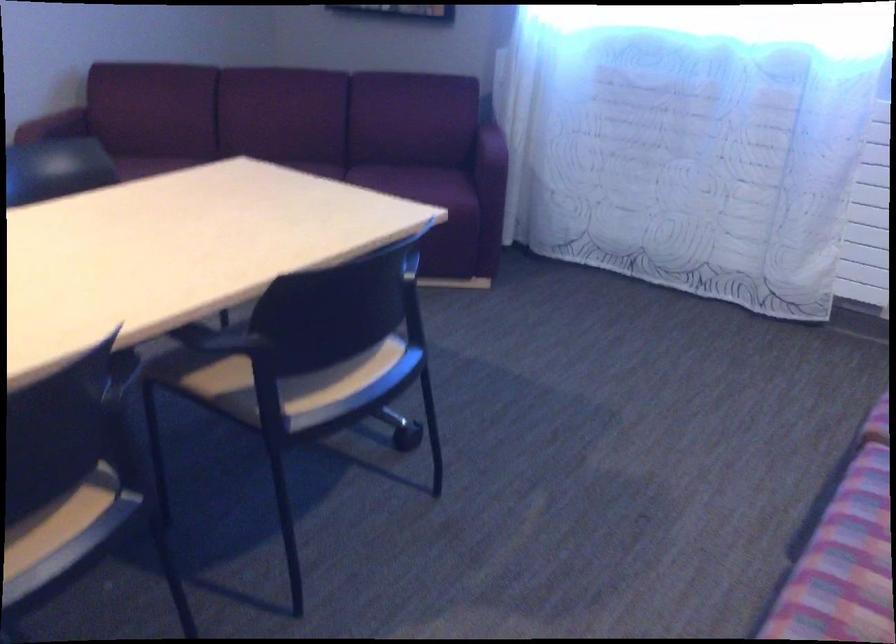
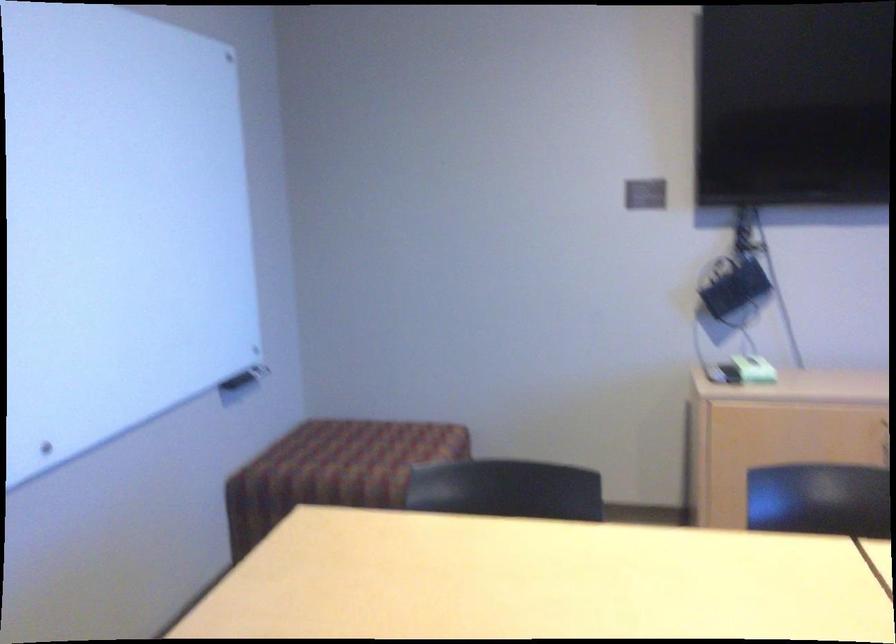
Question: The first image is from the beginning of the video and the second image is from the end. How did the camera likely rotate when shooting the video?

Choices:
 (A) Left
 (B) Right
 (C) Up
 (D) Down

Answer: (A)